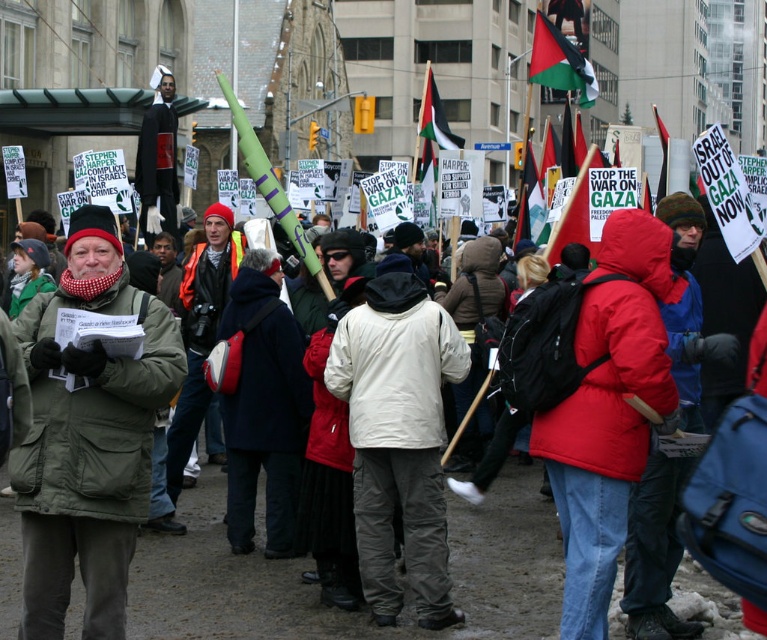
Consider the image. Who is shorter, white matte jacket at center or palestinian flag at upper center?

With less height is palestinian flag at upper center.

Measure the distance from white matte jacket at center to palestinian flag at upper center.

A distance of 79.48 feet exists between white matte jacket at center and palestinian flag at upper center.

Describe the element at coordinates (397, 436) in the screenshot. I see `white matte jacket at center` at that location.

Locate an element on the screen. The image size is (767, 640). white matte jacket at center is located at coordinates (397, 436).

Who is taller, matte red jacket at center or white matte jacket at center?

With more height is white matte jacket at center.

Does point (584, 529) lie behind point (407, 528)?

No, it is not.

The width and height of the screenshot is (767, 640). In order to click on matte red jacket at center in this screenshot , I will do `click(607, 410)`.

Can you confirm if green matte jacket at center is smaller than white matte jacket at center?

Indeed, green matte jacket at center has a smaller size compared to white matte jacket at center.

Is green matte jacket at center below white matte jacket at center?

No.

Identify the location of green matte jacket at center. Image resolution: width=767 pixels, height=640 pixels. (87, 438).

Where is `green matte jacket at center`? The height and width of the screenshot is (640, 767). green matte jacket at center is located at coordinates 87,438.